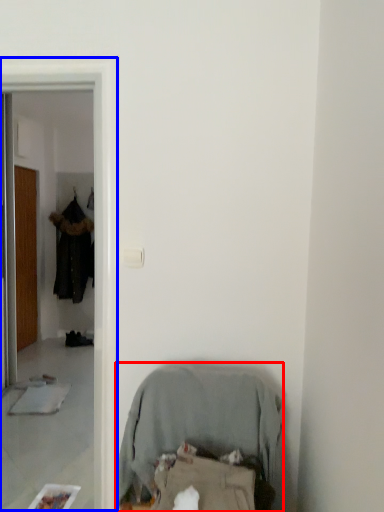
Question: Which of the following is the farthest to the observer, furniture (highlighted by a red box) or screen door (highlighted by a blue box)?

Choices:
 (A) furniture
 (B) screen door

Answer: (B)